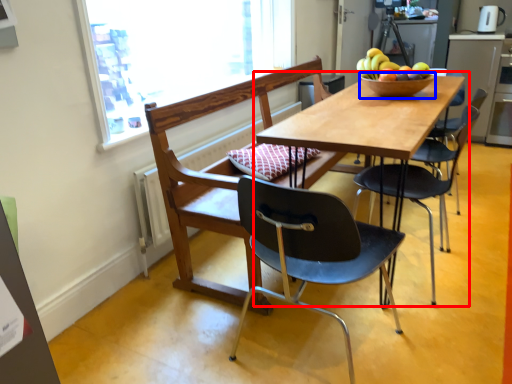
Question: Which object appears farthest to the camera in this image, table (highlighted by a red box) or bowl (highlighted by a blue box)?

Choices:
 (A) table
 (B) bowl

Answer: (B)